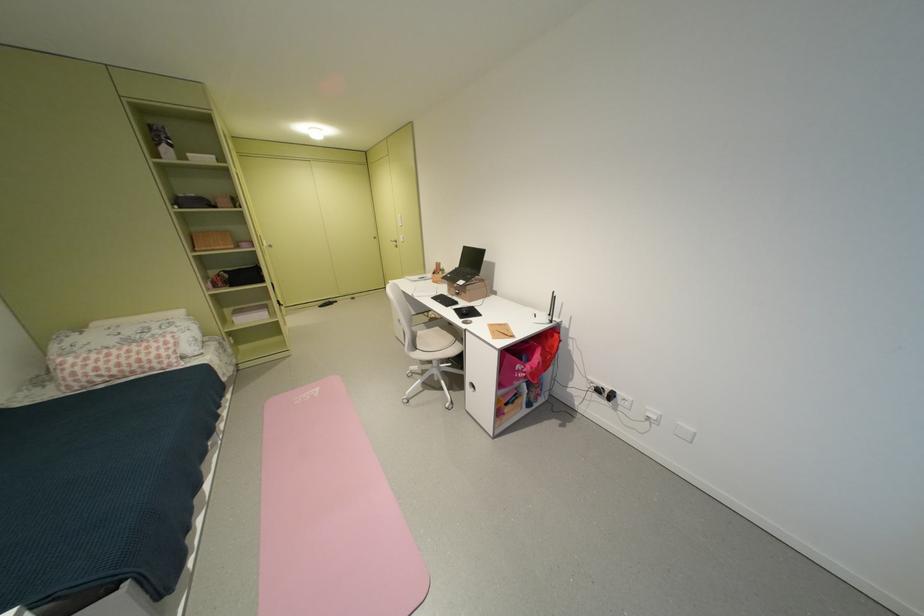
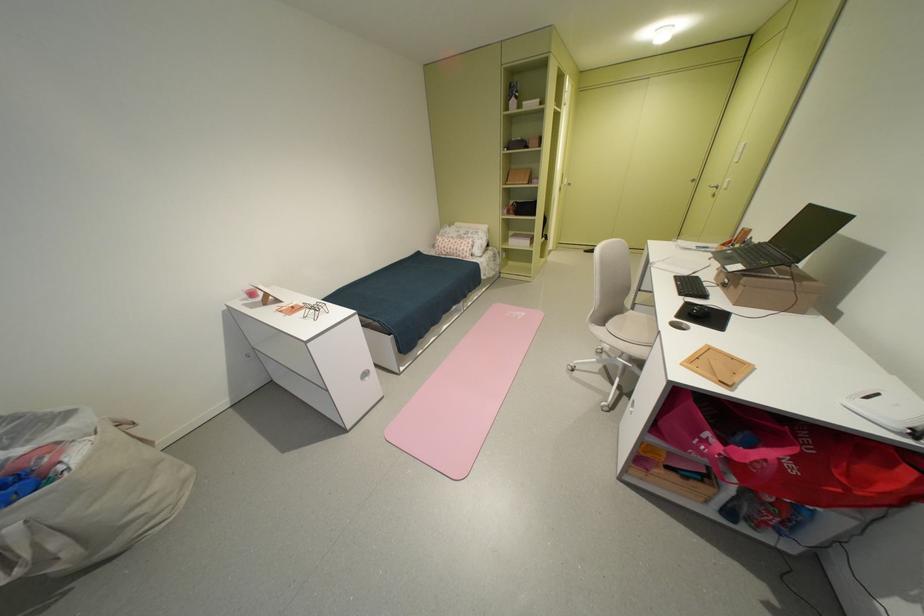
In the second image, find the point that corresponds to point (159, 362) in the first image.

(468, 252)